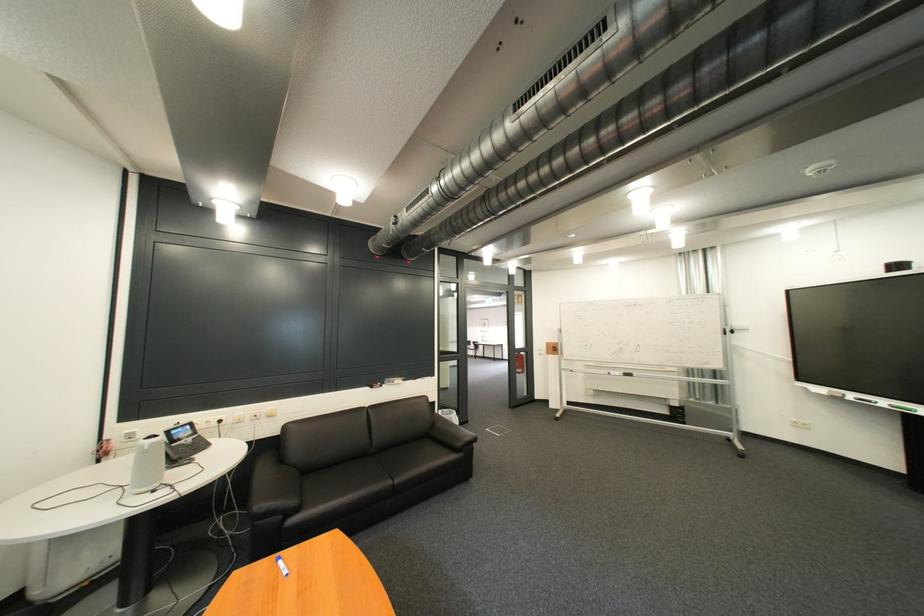
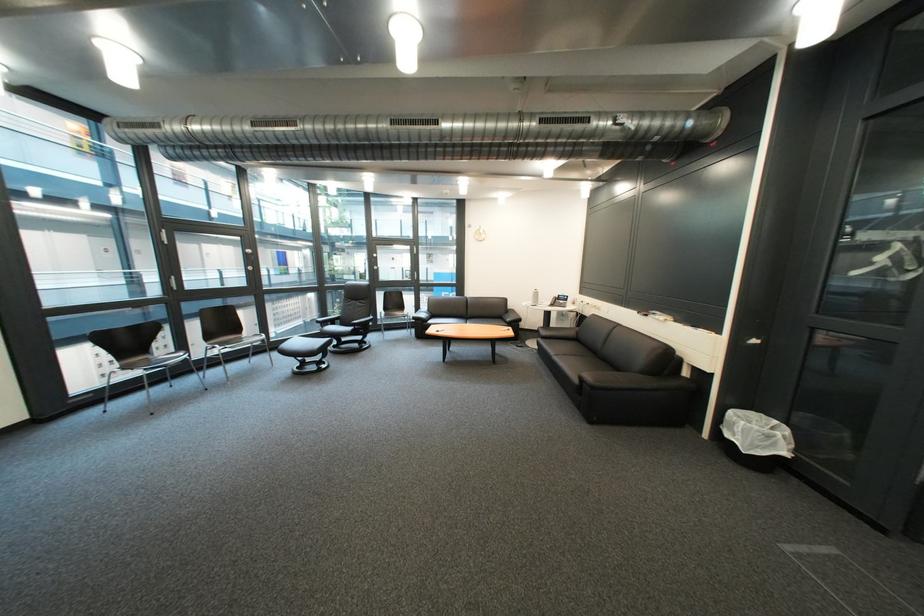
The point at (468,421) is marked in the first image. Where is the corresponding point in the second image?

(751, 431)